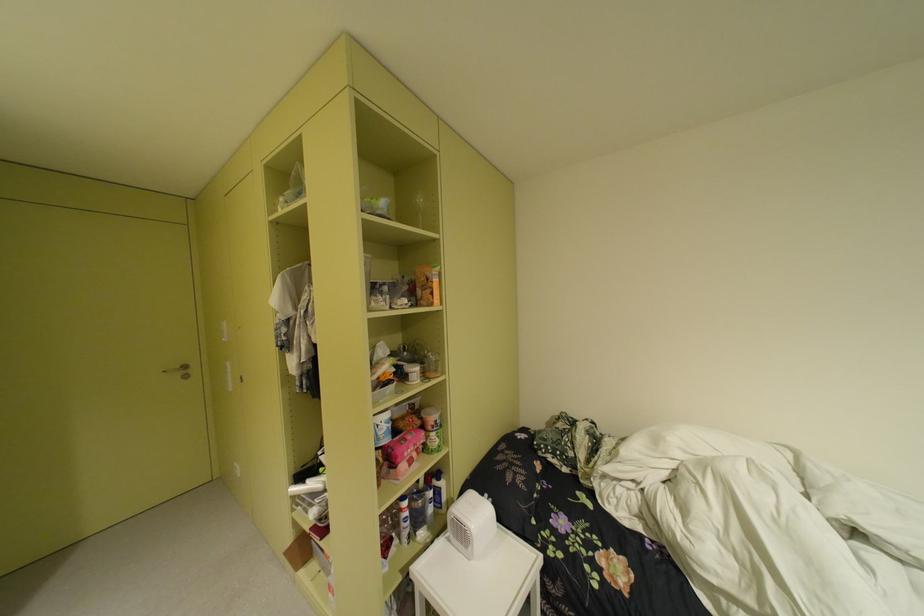
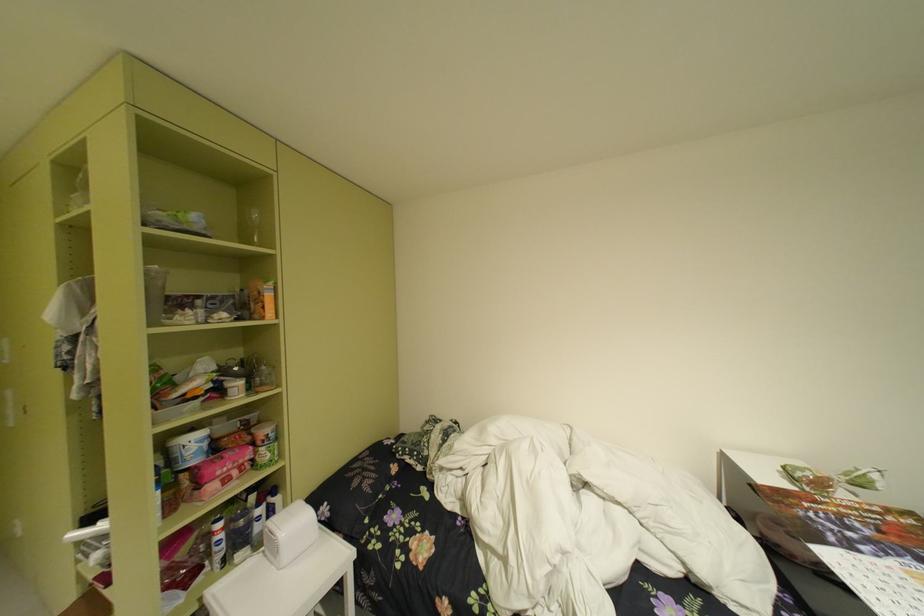
The point at [419,507] is marked in the first image. Where is the corresponding point in the second image?

(235, 528)